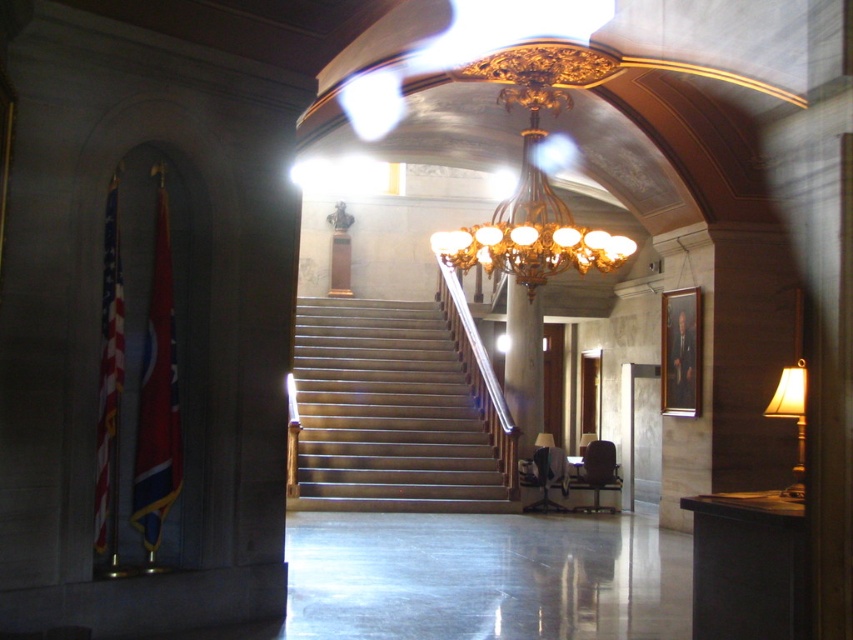
Question: Is polished wood stairs at center positioned at the back of gold/gilded chandelier at center?

Choices:
 (A) no
 (B) yes

Answer: (B)

Question: Which of the following is the farthest from the observer?

Choices:
 (A) polished wood stairs at center
 (B) gold/gilded chandelier at center

Answer: (A)

Question: Where is gold/gilded chandelier at center located in relation to matte gold lampshade at right in the image?

Choices:
 (A) right
 (B) left

Answer: (B)

Question: Which object is closer to the camera taking this photo?

Choices:
 (A) polished wood stairs at center
 (B) matte gold lampshade at right
 (C) gold/gilded chandelier at center

Answer: (B)

Question: Which point appears farthest from the camera in this image?

Choices:
 (A) (770, 403)
 (B) (476, 460)

Answer: (B)

Question: Is polished wood stairs at center in front of gold/gilded chandelier at center?

Choices:
 (A) no
 (B) yes

Answer: (A)